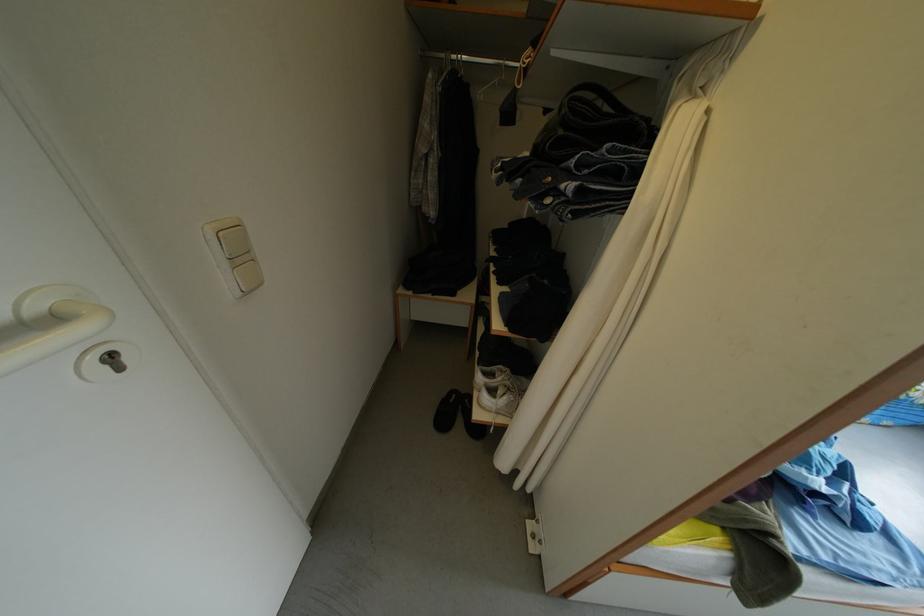
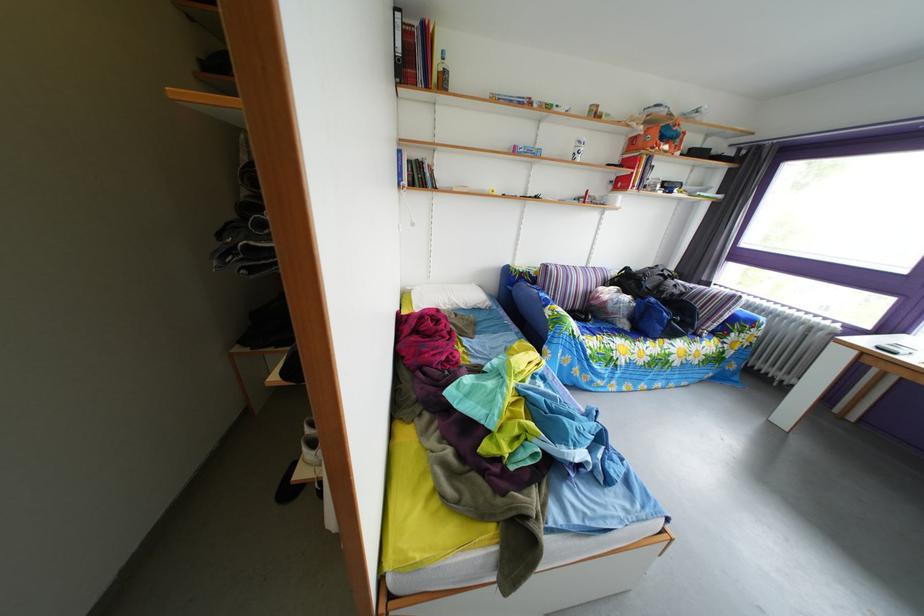
Question: The images are taken continuously from a first-person perspective. In which direction are you moving?

Choices:
 (A) Left
 (B) Right
 (C) Forward
 (D) Backward

Answer: (B)